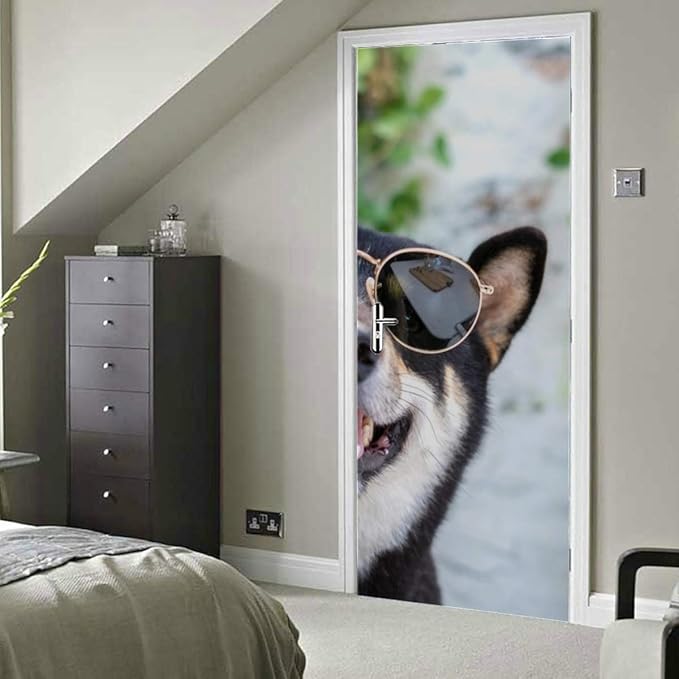
The height and width of the screenshot is (679, 679). Find the location of `doorframe with pick of black and tan dogs face`. doorframe with pick of black and tan dogs face is located at coordinates (474, 403), (479, 322), (481, 206), (469, 70).